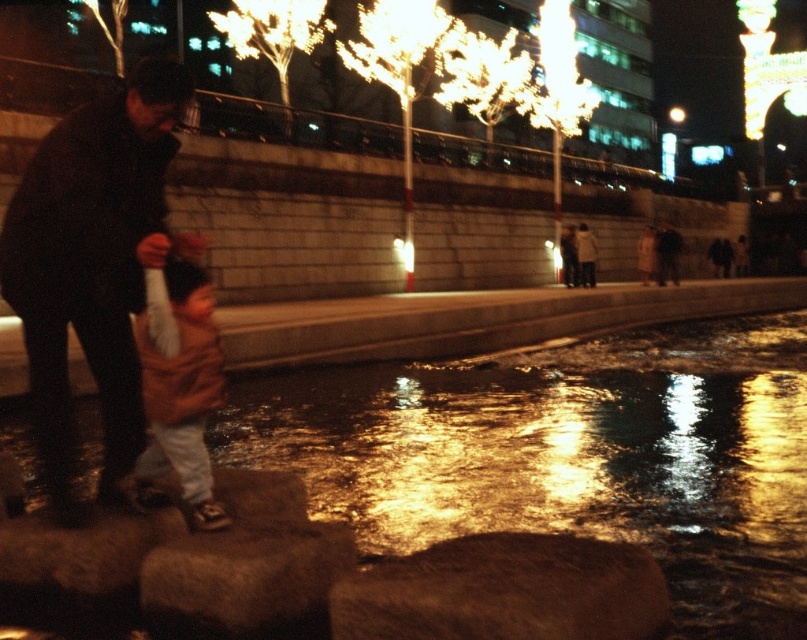
You are standing at the point marked by the coordinates provided. Looking around, you see a brown rough stone at center. Can you confirm if the brown rough stone at center is exactly at the coordinates point (x=504, y=592)?

Yes, the brown rough stone at center is located at point (x=504, y=592) according to the description.

You are a photographer trying to capture the dark brown leather jacket at left in your shot. The camera is set to focus at point 0.409 on the horizontal axis. Will the jacket be in focus?

The dark brown leather jacket at left is positioned at point 0.409 on the horizontal axis, so yes, it will be in focus since the camera is set to focus at that exact horizontal position.

You are a photographer trying to capture a clear shot of the light brown cotton shirt at center and the dark brown leather jacket at left. Since the figures are slightly blurred, you want to adjust your camera to focus on the closest object. Which object should you focus on?

The dark brown leather jacket at left is positioned over the light brown cotton shirt at center, so it is closer to the camera. You should focus on the dark brown leather jacket at left.